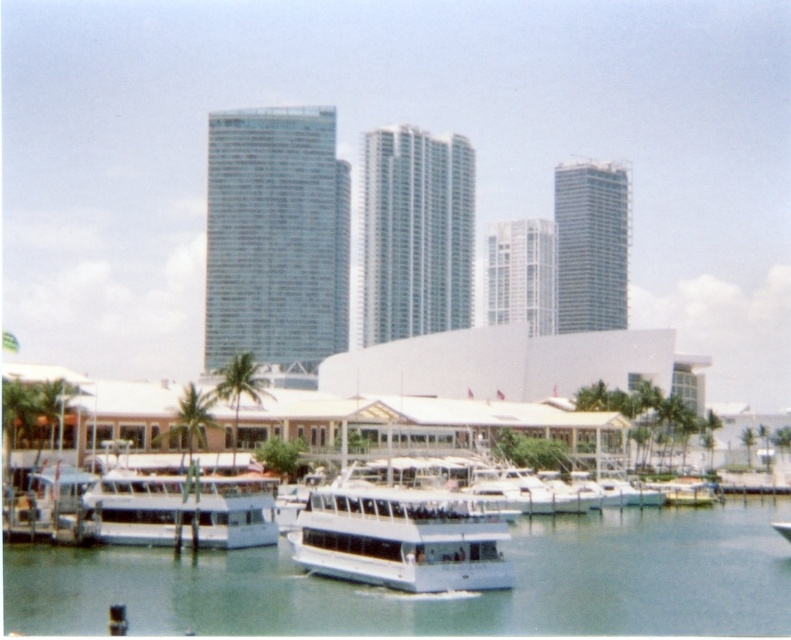
Is white glossy boat at lower left to the left of green leafy palm tree at lower left from the viewer's perspective?

No, white glossy boat at lower left is not to the left of green leafy palm tree at lower left.

Is white glossy boat at lower left positioned in front of green leafy palm tree at lower left?

Yes, it is in front of green leafy palm tree at lower left.

Who is more distant from viewer, (199, 528) or (229, 396)?

Point (229, 396)

This screenshot has width=791, height=640. What are the coordinates of `white glossy boat at lower left` in the screenshot? It's located at click(x=182, y=509).

Does white glossy boat at center have a smaller size compared to green leafy palm tree at lower left?

Yes.

In the scene shown: Between white glossy boat at center and green leafy palm tree at lower left, which one is positioned higher?

green leafy palm tree at lower left is higher up.

Locate an element on the screen. Image resolution: width=791 pixels, height=640 pixels. white glossy boat at center is located at coordinates (400, 538).

You are a GUI agent. You are given a task and a screenshot of the screen. Output one action in this format:
    pyautogui.click(x=<x>, y=<y>)
    Task: Click on the white glossy boat at center
    
    Given the screenshot: What is the action you would take?
    coord(400,538)

Who is positioned more to the right, clear water at center or white glossy boat at center?

From the viewer's perspective, clear water at center appears more on the right side.

Is clear water at center taller than white glossy boat at center?

Indeed, clear water at center has a greater height compared to white glossy boat at center.

The height and width of the screenshot is (640, 791). I want to click on clear water at center, so click(x=437, y=595).